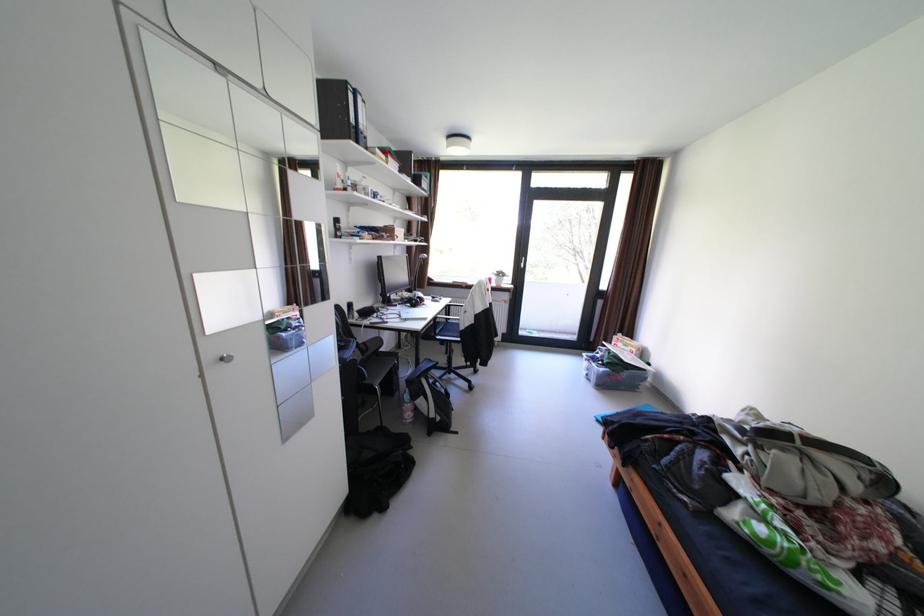
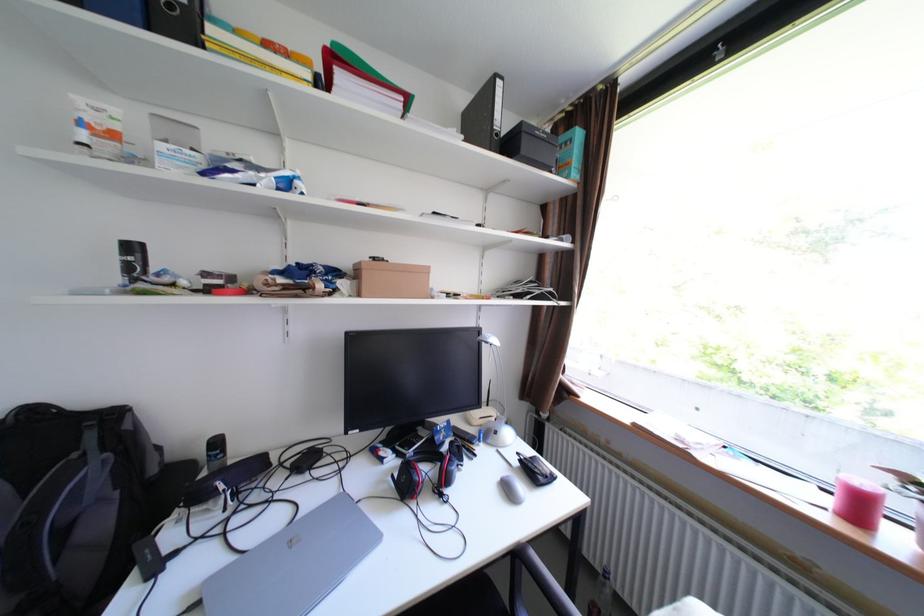
Where in the second image is the point corresponding to the point at 347,221 from the first image?

(143, 248)